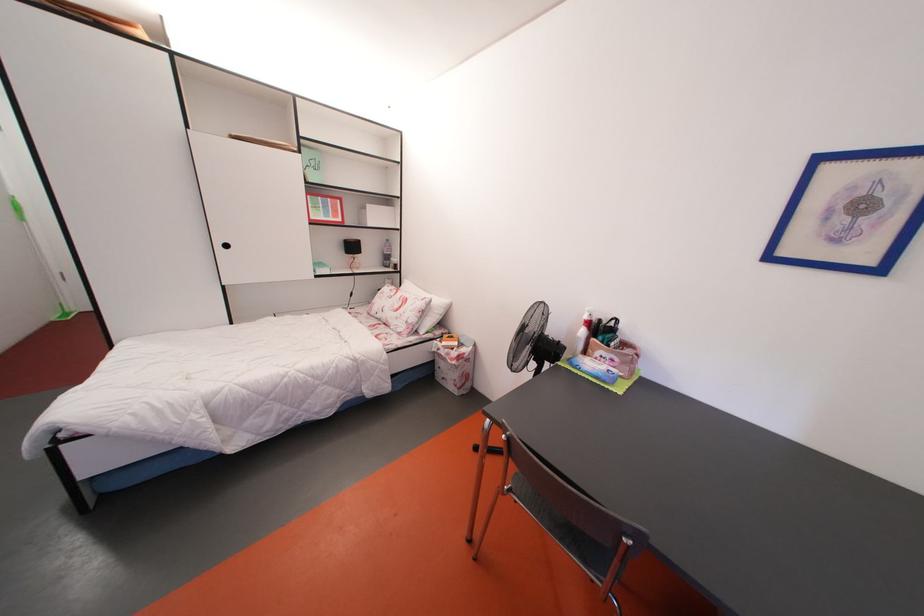
Where is `black cabinet handle`? The image size is (924, 616). black cabinet handle is located at coordinates (225, 245).